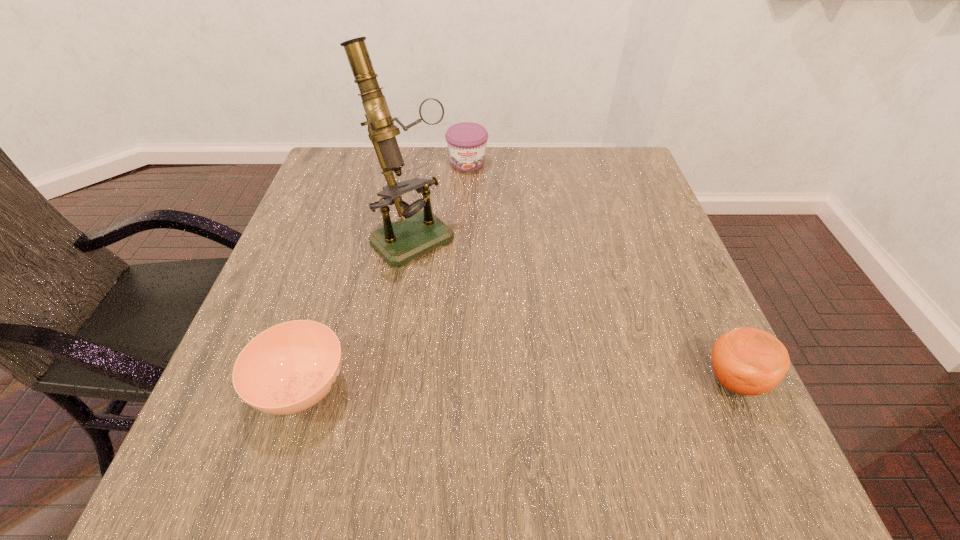
Locate an element on the screen. free spot located 0.080m at the eyepiece of the second farthest object is located at coordinates (456, 282).

You are a GUI agent. You are given a task and a screenshot of the screen. Output one action in this format:
    pyautogui.click(x=<x>, y=<y>)
    Task: Click on the free space located at the eyepiece of the second farthest object
    The height and width of the screenshot is (540, 960).
    Given the screenshot: What is the action you would take?
    pyautogui.click(x=522, y=347)

Locate an element on the screen. free point located on the front label of the second shortest object is located at coordinates (473, 198).

The height and width of the screenshot is (540, 960). What are the coordinates of `free location located 0.250m on the front label of the second shortest object` in the screenshot? It's located at [x=479, y=233].

Where is `free location located 0.310m on the front label of the second shortest object`? This screenshot has width=960, height=540. free location located 0.310m on the front label of the second shortest object is located at coordinates pos(482,250).

At what (x,y) coordinates should I click in order to perform the action: click on object located at the far edge. Please return your answer as a coordinate pair (x, y). The width and height of the screenshot is (960, 540). Looking at the image, I should click on (466, 141).

This screenshot has width=960, height=540. I want to click on soup bowl that is positioned at the near edge, so click(288, 368).

Where is `orange located at the near edge`? The width and height of the screenshot is (960, 540). orange located at the near edge is located at coordinates (748, 361).

You are a GUI agent. You are given a task and a screenshot of the screen. Output one action in this format:
    pyautogui.click(x=<x>, y=<y>)
    Task: Click on the object that is positioned at the left edge
    
    Given the screenshot: What is the action you would take?
    pyautogui.click(x=288, y=368)

Where is `object located in the right edge section of the desktop`? This screenshot has width=960, height=540. object located in the right edge section of the desktop is located at coordinates (748, 361).